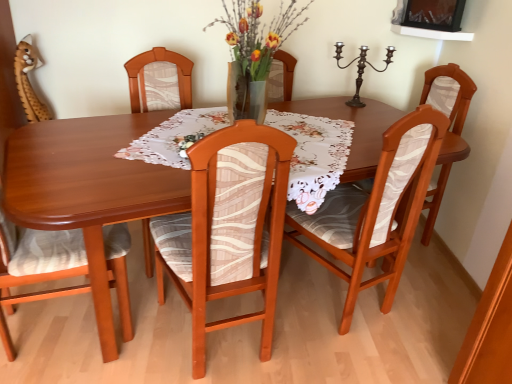
Where is `free spot below matte wood chair at left, the first chair viewed from the left (from a real-world perspective)`? The height and width of the screenshot is (384, 512). free spot below matte wood chair at left, the first chair viewed from the left (from a real-world perspective) is located at coordinates (57, 329).